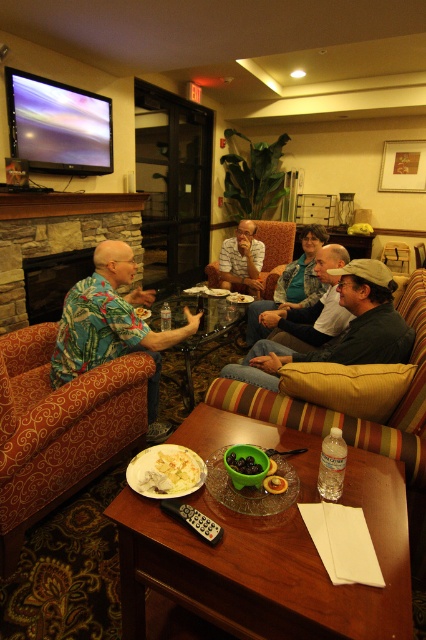
You are standing at the entrance of the living room and want to place a decorative vase on the wall. There are two points marked on the wall at coordinates point [166,472] and point [270,492]. Which point is closer to the fireplace located on the left side of the room?

Point [166,472] is behind point [270,492]. Since the fireplace is on the left side of the room, the point closer to it would depend on their positions relative to the left wall. However, based on the given description, point [166,472] is behind point [270,492], meaning it is farther from the entrance. Without specific leftward positioning data, we cannot definitively determine proximity to the fireplace.

You are a guest at a dinner party and see the white creamy sauce at center and the golden brown pastry at center on the table. Which one takes up more space on the table?

The white creamy sauce at center is bigger than the golden brown pastry at center, so it takes up more space on the table.